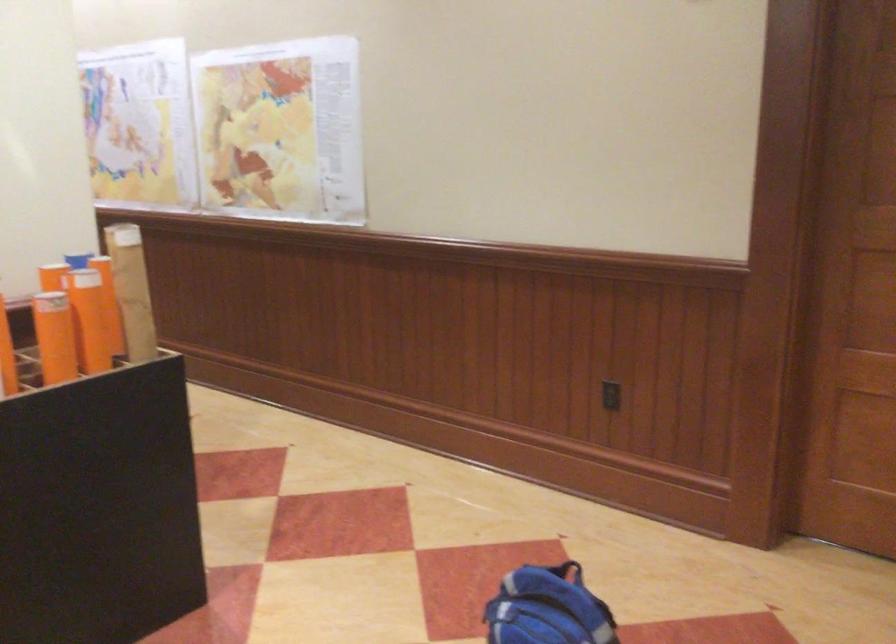
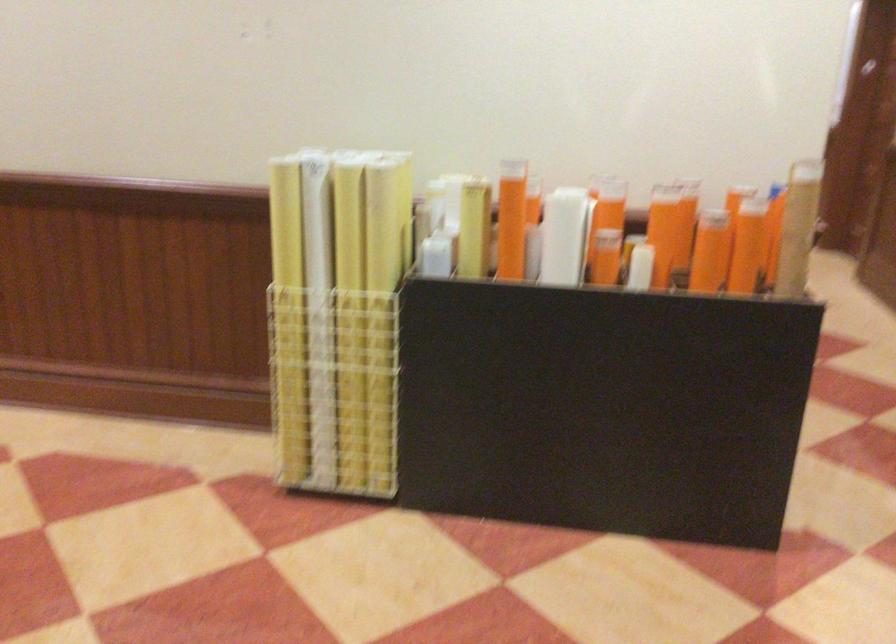
Find the pixel in the second image that matches point 74,333 in the first image.

(710, 251)